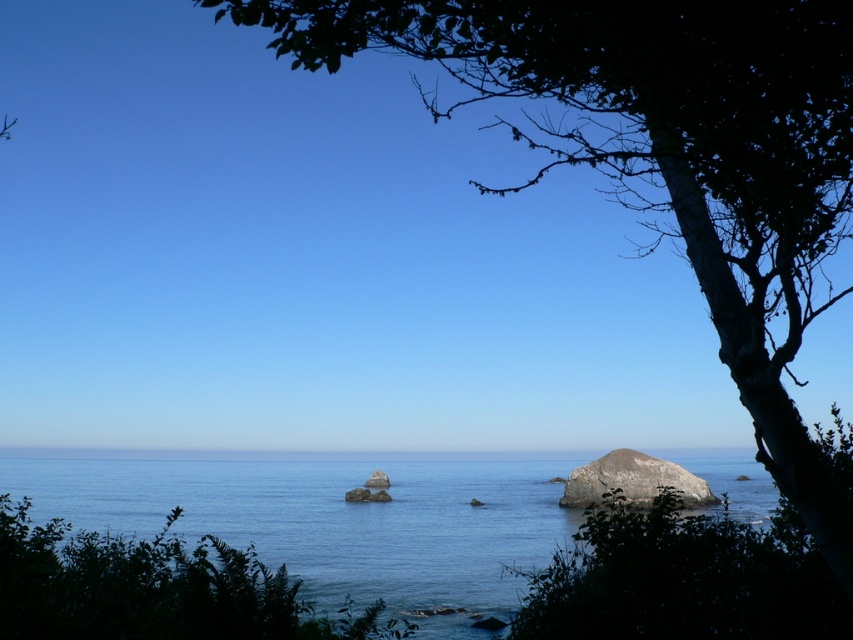
You are standing behind a bush and looking at the blue water at center and the smooth gray rock at center. Which object is more to the right?

The smooth gray rock at center is more to the right because the blue water at center is positioned on the left side of it.